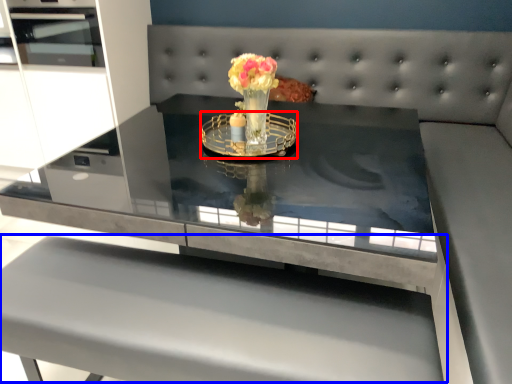
Question: Among these objects, which one is nearest to the camera, glass plate (highlighted by a red box) or table (highlighted by a blue box)?

Choices:
 (A) glass plate
 (B) table

Answer: (B)